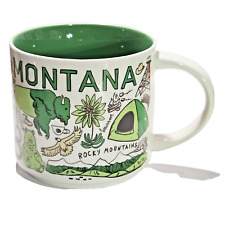
I want to click on green color of inside of cup, so click(73, 37).